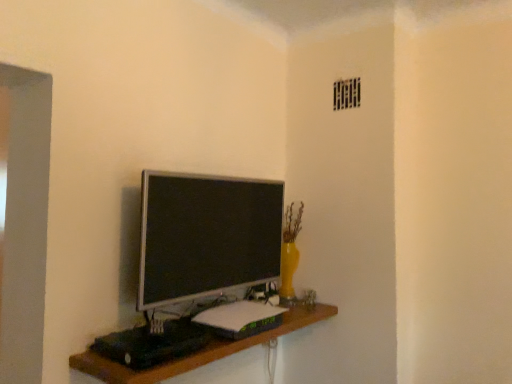
Question: In terms of width, does satin silver monitor at center look wider or thinner when compared to wooden shelf at center?

Choices:
 (A) wide
 (B) thin

Answer: (B)

Question: Considering their positions, is satin silver monitor at center located in front of or behind wooden shelf at center?

Choices:
 (A) front
 (B) behind

Answer: (B)

Question: Does point coord(188,236) appear closer or farther from the camera than point coord(114,374)?

Choices:
 (A) farther
 (B) closer

Answer: (A)

Question: In terms of width, does wooden shelf at center look wider or thinner when compared to satin silver monitor at center?

Choices:
 (A) thin
 (B) wide

Answer: (B)

Question: Considering their positions, is wooden shelf at center located in front of or behind satin silver monitor at center?

Choices:
 (A) behind
 (B) front

Answer: (B)

Question: From the image's perspective, is wooden shelf at center located above or below satin silver monitor at center?

Choices:
 (A) above
 (B) below

Answer: (B)

Question: Considering the positions of wooden shelf at center and satin silver monitor at center in the image, is wooden shelf at center taller or shorter than satin silver monitor at center?

Choices:
 (A) short
 (B) tall

Answer: (A)